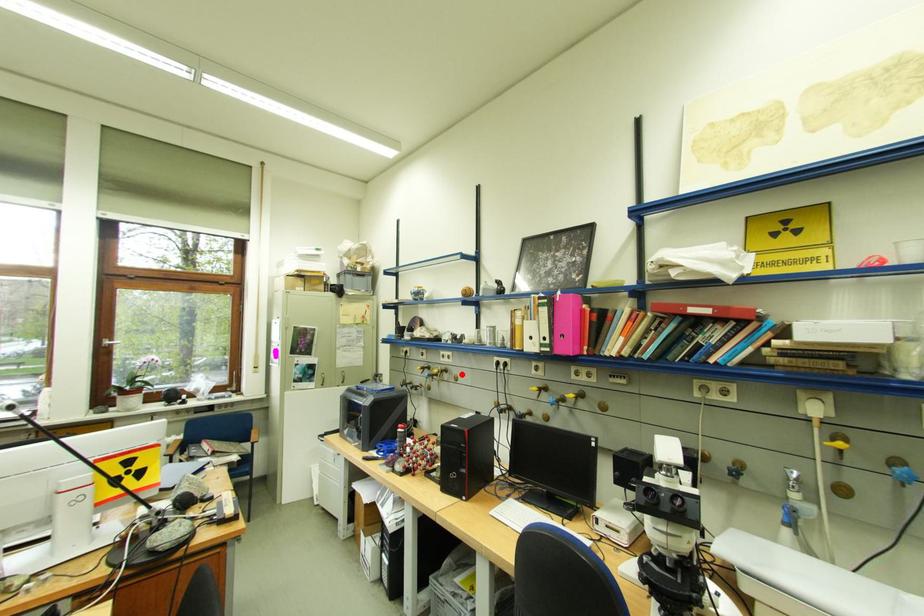
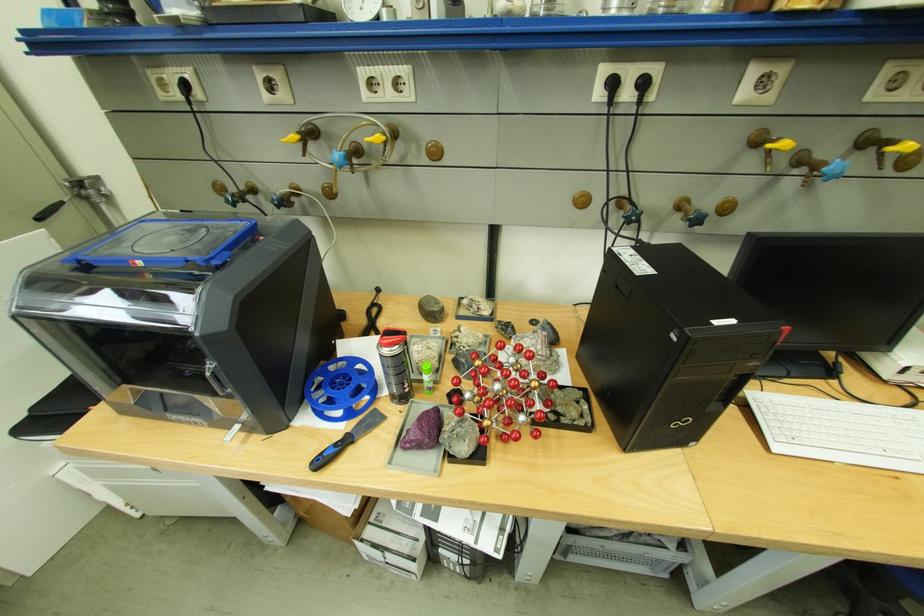
Question: I am providing you with two images of the same scene from different viewpoints. A red point is marked on the first image. Is the red point's position out of view in image 2?

Choices:
 (A) Yes
 (B) No

Answer: (B)